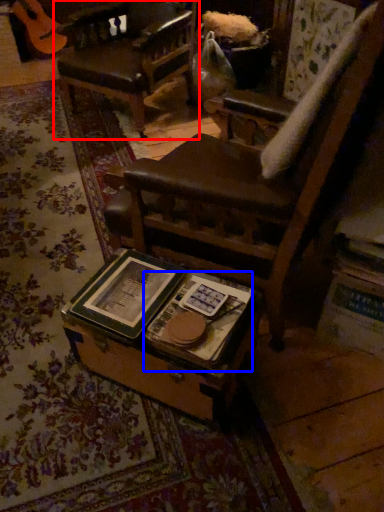
Question: Which point is further to the camera, chair (highlighted by a red box) or paperback book (highlighted by a blue box)?

Choices:
 (A) chair
 (B) paperback book

Answer: (A)